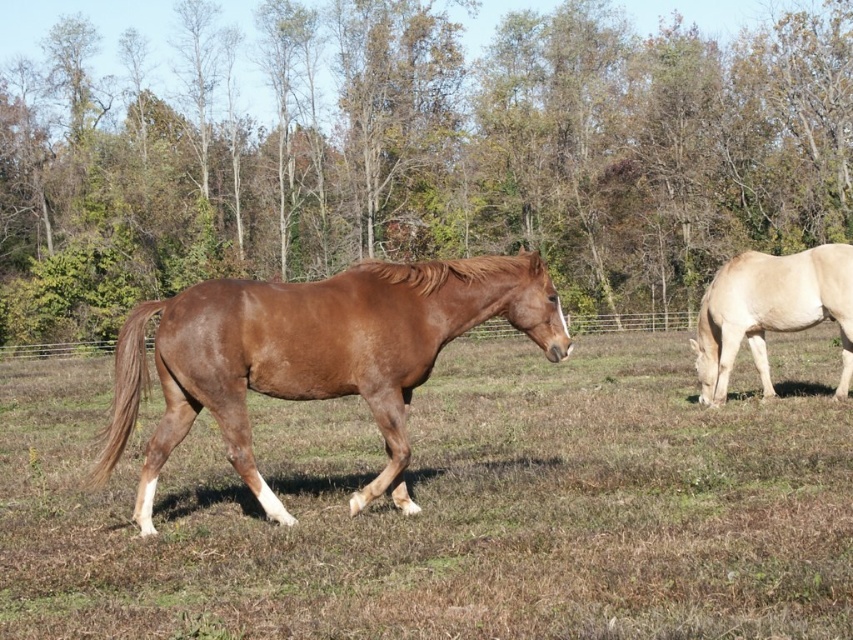
Measure the distance between point (215, 339) and camera.

They are 5.81 meters apart.

Which is behind, point (302, 372) or point (791, 269)?

The point (791, 269) is more distant.

What are the coordinates of `brown glossy horse at center` in the screenshot? It's located at (315, 355).

Is green leafy tree at center to the right of brown horse at center from the viewer's perspective?

No, green leafy tree at center is not to the right of brown horse at center.

Which is below, green leafy tree at center or brown horse at center?

brown horse at center is lower down.

Is point (12, 212) closer to viewer compared to point (648, 436)?

No, (12, 212) is further to viewer.

The width and height of the screenshot is (853, 640). I want to click on green leafy tree at center, so click(x=419, y=154).

Who is higher up, brown horse at center or brown glossy horse at center?

Positioned higher is brown glossy horse at center.

Locate an element on the screen. This screenshot has width=853, height=640. brown horse at center is located at coordinates (450, 506).

Identify the location of brown horse at center. (450, 506).